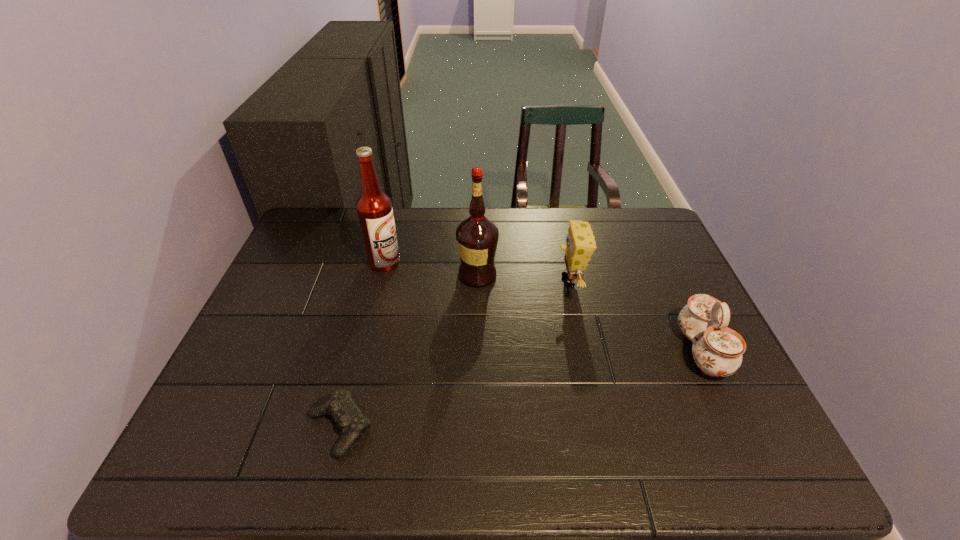
This screenshot has height=540, width=960. I want to click on vacant space at the left edge of the desktop, so click(x=263, y=369).

The height and width of the screenshot is (540, 960). Identify the location of free region at the right edge of the desktop. (643, 260).

In the image, there is a desktop. At what (x,y) coordinates should I click in order to perform the action: click on vacant space at the far left corner. Please return your answer as a coordinate pair (x, y). This screenshot has height=540, width=960. Looking at the image, I should click on (311, 212).

Locate an element on the screen. The height and width of the screenshot is (540, 960). empty location between the left alcohol and the control is located at coordinates (362, 345).

The width and height of the screenshot is (960, 540). Find the location of `blank region between the third object from left to right and the control`. blank region between the third object from left to right and the control is located at coordinates (409, 352).

You are a GUI agent. You are given a task and a screenshot of the screen. Output one action in this format:
    pyautogui.click(x=<x>, y=<y>)
    Task: Click on the vacant area that lies between the fourth farthest object and the fourth object from left to right
    The height and width of the screenshot is (540, 960).
    Given the screenshot: What is the action you would take?
    pyautogui.click(x=636, y=316)

Where is `free space between the second nearest object and the nearest object`? This screenshot has width=960, height=540. free space between the second nearest object and the nearest object is located at coordinates (520, 389).

The width and height of the screenshot is (960, 540). What are the coordinates of `empty space between the shortest object and the right alcohol` in the screenshot? It's located at (409, 352).

Where is `free spot between the chinaware and the second object from right to left`? The width and height of the screenshot is (960, 540). free spot between the chinaware and the second object from right to left is located at coordinates (636, 316).

Locate an element on the screen. This screenshot has width=960, height=540. free space that is in between the nearest object and the second nearest object is located at coordinates (520, 389).